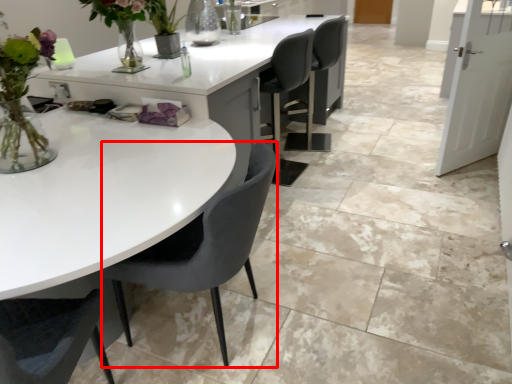
Question: Where is chair (annotated by the red box) located in relation to table in the image?

Choices:
 (A) left
 (B) right

Answer: (A)